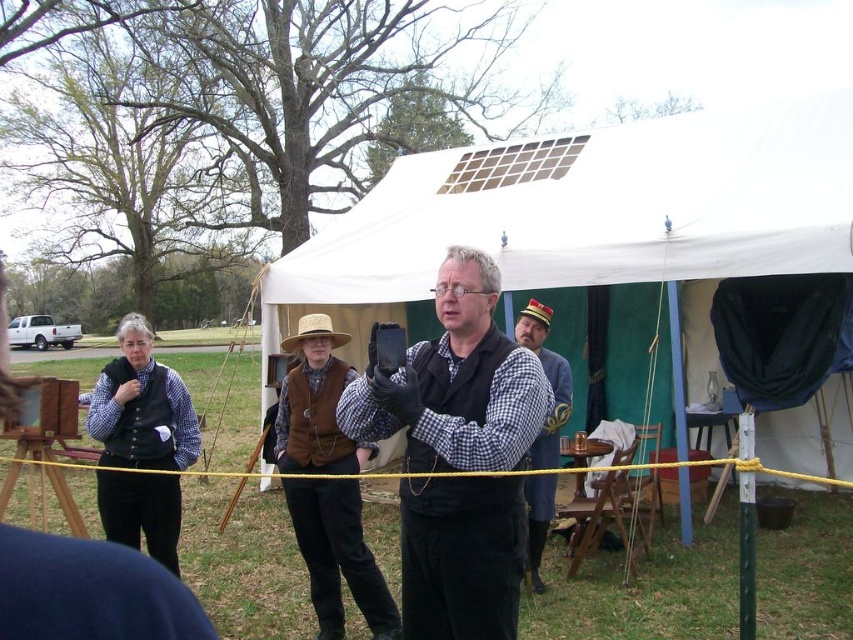
You are a visitor at this historical event and want to take a photo of the white canvas tent at center and the brown leather hat at center together in the frame. What is the minimum distance you need to move back from the current position to include both objects in your photo?

The white canvas tent at center and brown leather hat at center are 3.45 meters apart from each other. To capture both in the same frame, you need to move back at least 3.45 meters to ensure both objects are visible.

You are a visitor at the historical reenactment event. You want to take a photo of the white canvas tent at center while standing near the brown straw cowboy hat at center. Is there enough space between them for you to position yourself without entering the restricted area marked by the yellow caution tape?

The white canvas tent at center and brown straw cowboy hat at center are 4.88 meters apart. Since the yellow caution tape is in front of the tent, you can stand near the brown straw cowboy hat at center and take the photo without crossing the tape as the distance allows sufficient space.

You are an event organizer who needs to ensure that the white canvas tent at center and the brown leather hat at center are visible to all attendees. Given their sizes, which object might require a more elevated display to ensure visibility?

The brown leather hat at center requires a more elevated display since the white canvas tent at center is smaller than it, making the hat harder to see from a distance.